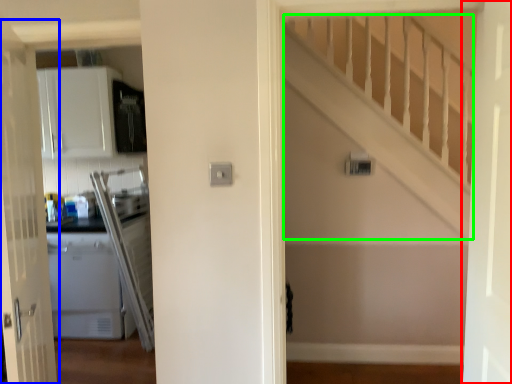
Question: Estimate the real-world distances between objects in this image. Which object is farther from door (highlighted by a red box), door (highlighted by a blue box) or stairwell (highlighted by a green box)?

Choices:
 (A) door
 (B) stairwell

Answer: (A)